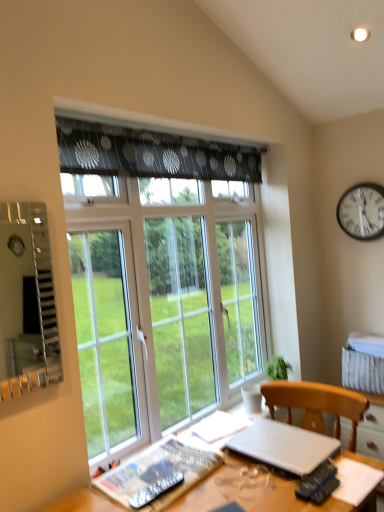
Question: Relative to wooden desk at lower center, is transparent glass window at center in front or behind?

Choices:
 (A) behind
 (B) front

Answer: (A)

Question: From a real-world perspective, relative to wooden desk at lower center, is transparent glass window at center vertically above or below?

Choices:
 (A) above
 (B) below

Answer: (A)

Question: Considering the real-world distances, which object is farthest from the metallic silver remote at lower center?

Choices:
 (A) black metal clock at upper right
 (B) wooden desk at lower center
 (C) transparent glass window at center
 (D) silver metallic laptop at lower right

Answer: (A)

Question: Which is farther from the transparent glass window at center?

Choices:
 (A) silver metallic laptop at lower right
 (B) wooden desk at lower center
 (C) metallic silver remote at lower center
 (D) black metal clock at upper right

Answer: (D)